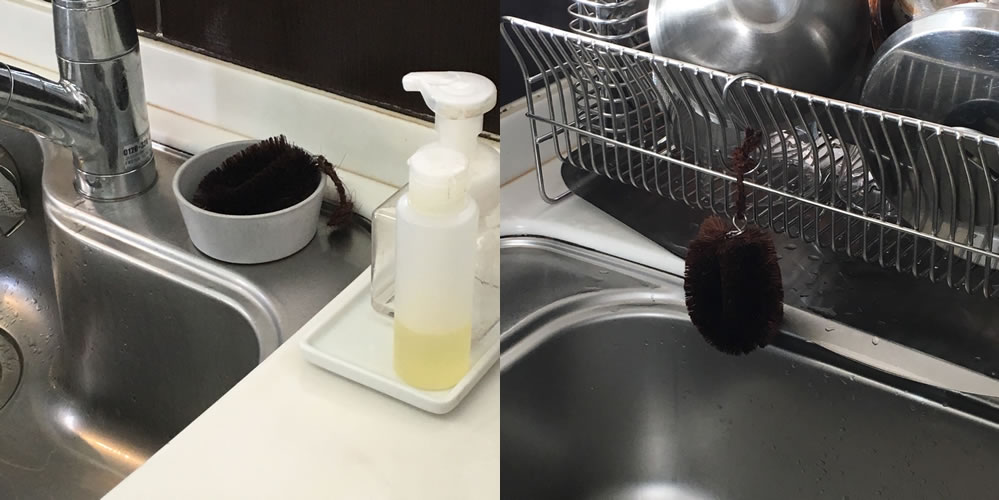
Identify the location of dishwashing liquid. (423, 340).